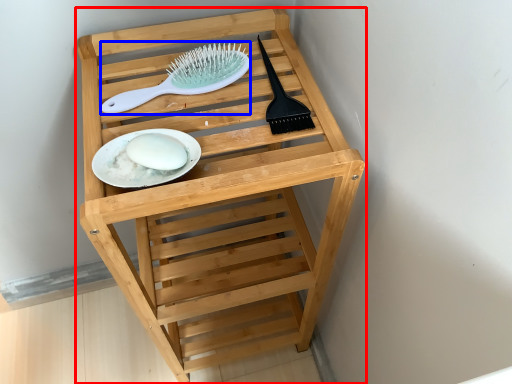
Question: Among these objects, which one is nearest to the camera, furniture (highlighted by a red box) or brush (highlighted by a blue box)?

Choices:
 (A) furniture
 (B) brush

Answer: (A)